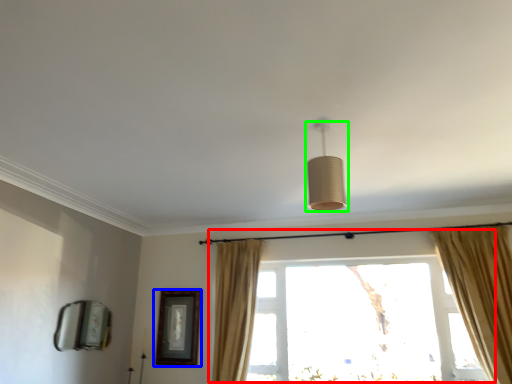
Question: Which object is positioned farthest from window (highlighted by a red box)? Select from picture frame (highlighted by a blue box) and lamp (highlighted by a green box).

Choices:
 (A) picture frame
 (B) lamp

Answer: (B)